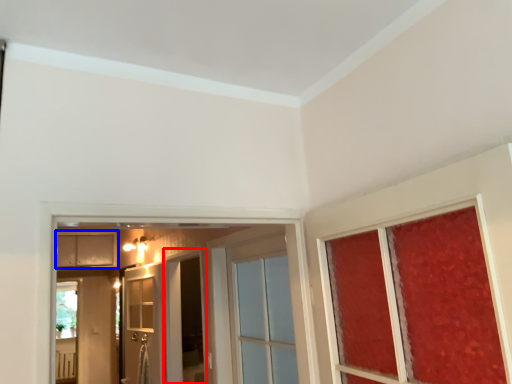
Question: Among these objects, which one is nearest to the camera, screen door (highlighted by a red box) or cabinetry (highlighted by a blue box)?

Choices:
 (A) screen door
 (B) cabinetry

Answer: (A)